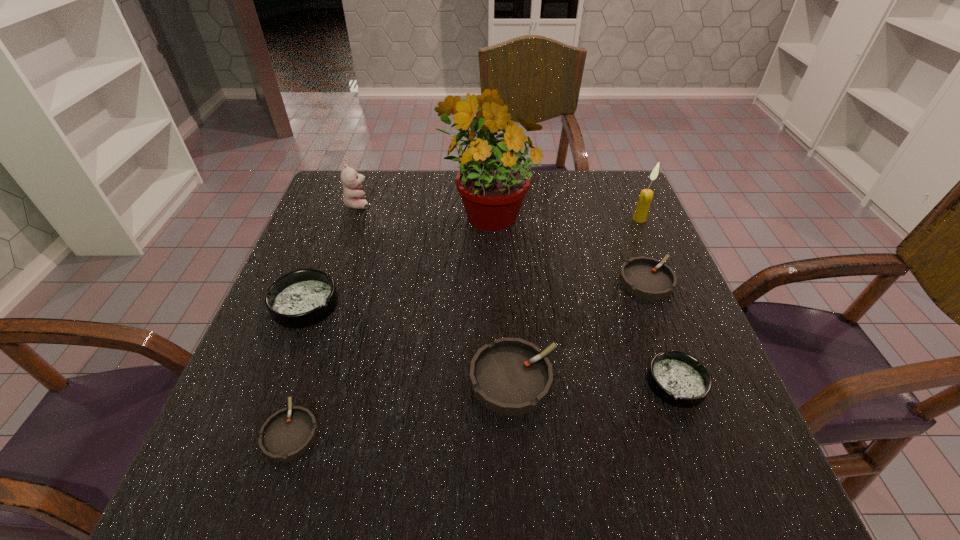
At what (x,y) coordinates should I click in order to perform the action: click on the rightmost gray ashtray. Please return your answer as a coordinate pair (x, y). The width and height of the screenshot is (960, 540). Looking at the image, I should click on (647, 278).

You are a GUI agent. You are given a task and a screenshot of the screen. Output one action in this format:
    pyautogui.click(x=<x>, y=<y>)
    Task: Click on the farthest gray ashtray
    The image size is (960, 540).
    Given the screenshot: What is the action you would take?
    pyautogui.click(x=647, y=278)

Where is `the right dark ashtray`? Image resolution: width=960 pixels, height=540 pixels. the right dark ashtray is located at coordinates (677, 378).

You are a GUI agent. You are given a task and a screenshot of the screen. Output one action in this format:
    pyautogui.click(x=<x>, y=<y>)
    Task: Click on the smaller dark ashtray
    The width and height of the screenshot is (960, 540).
    Given the screenshot: What is the action you would take?
    pyautogui.click(x=677, y=378)

Find the location of `the shortest object`. the shortest object is located at coordinates (287, 434).

The height and width of the screenshot is (540, 960). I want to click on the leftmost gray ashtray, so click(287, 434).

Where is `free space located on the front of the red flowerpot`? This screenshot has height=540, width=960. free space located on the front of the red flowerpot is located at coordinates (489, 256).

Where is `vacant space situated 0.370m on the left of the cream candle`? The image size is (960, 540). vacant space situated 0.370m on the left of the cream candle is located at coordinates point(496,219).

This screenshot has height=540, width=960. Identify the location of vacant space positioned 0.060m at the face of the third tallest object. (392, 204).

The height and width of the screenshot is (540, 960). In order to click on vacant space located 0.120m on the back of the biggest gray ashtray in this screenshot , I will do `click(509, 302)`.